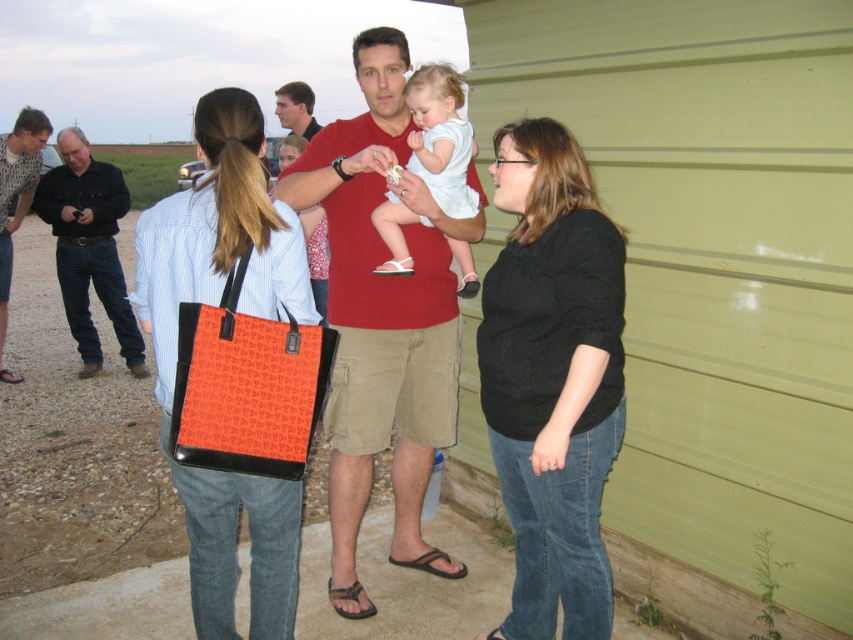
Question: Which object is positioned closest to the black knit sweater at center?

Choices:
 (A) orange fabric tote bag at center
 (B) black cotton shirt at left
 (C) white cotton dress at center

Answer: (C)

Question: Which object appears closest to the camera in this image?

Choices:
 (A) orange fabric tote bag at center
 (B) brushed metal shirt at left

Answer: (A)

Question: Does orange fabric tote bag at center appear over brushed metal shirt at left?

Choices:
 (A) no
 (B) yes

Answer: (A)

Question: Does matte red shirt at center have a greater width compared to black rubber sandal at lower center?

Choices:
 (A) yes
 (B) no

Answer: (A)

Question: Can you confirm if white cotton dress at center is positioned above black rubber sandal at lower center?

Choices:
 (A) no
 (B) yes

Answer: (B)

Question: Estimate the real-world distances between objects in this image. Which object is closer to the black knit sweater at center?

Choices:
 (A) brushed metal shirt at left
 (B) orange fabric tote bag at center

Answer: (B)